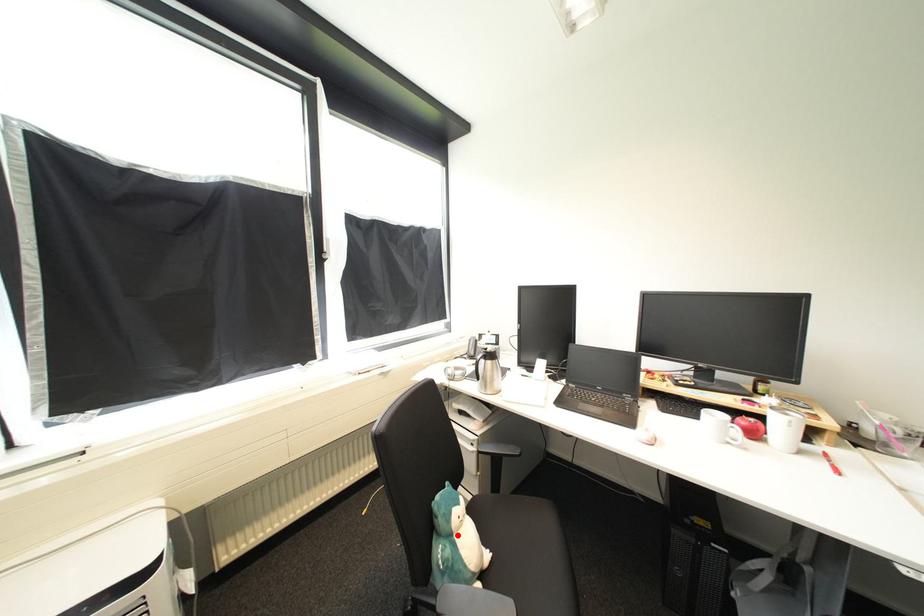
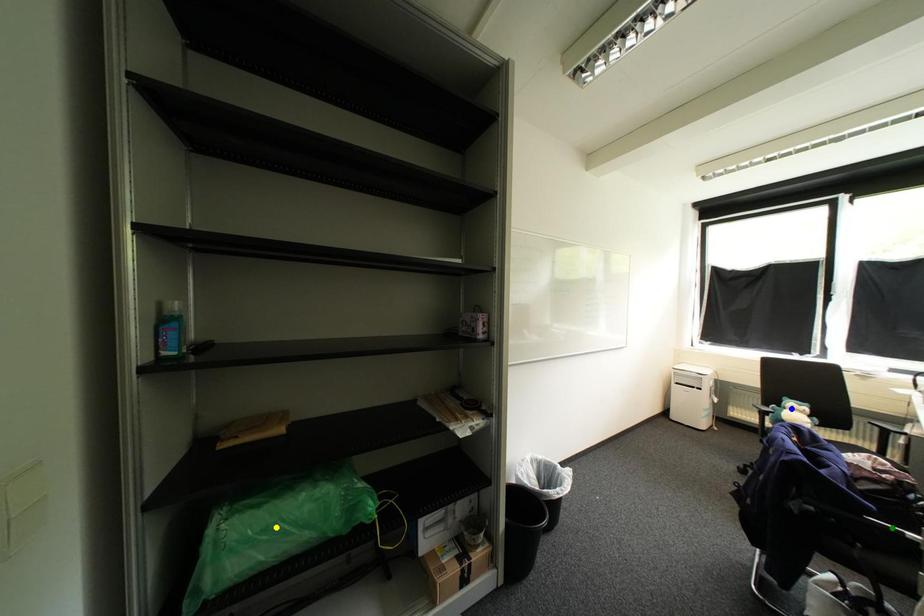
Question: I am providing you with two images of the same scene from different viewpoints. A red point is marked on the first image. You are given multiple points on the second image. In image 2, which mark is for the same physical point as the one in image 1?

Choices:
 (A) yellow point
 (B) blue point
 (C) green point

Answer: (B)